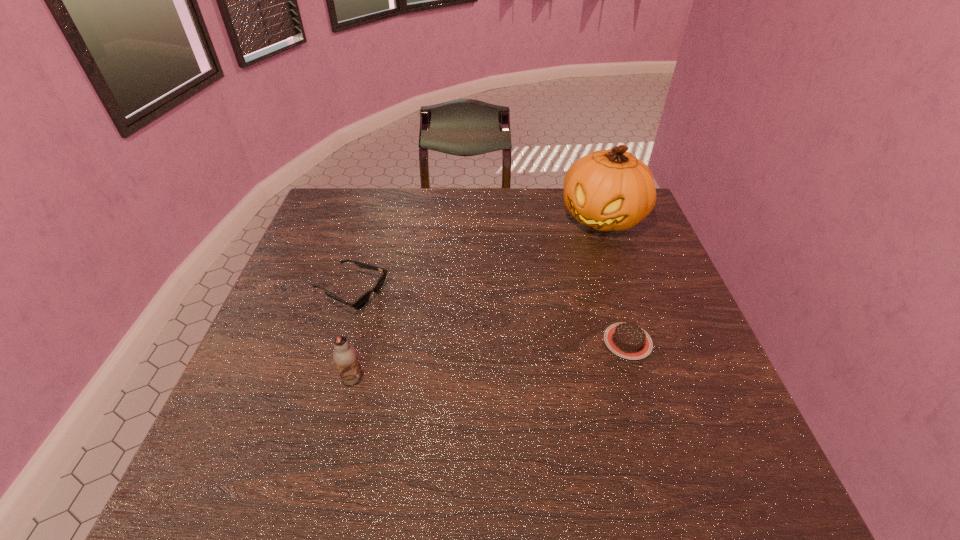
Where is `the nearest object`? This screenshot has height=540, width=960. the nearest object is located at coordinates (345, 357).

Find the location of `the third shortest object`. the third shortest object is located at coordinates (345, 357).

I want to click on the shortest object, so click(x=627, y=340).

Find the location of a particular element. The image size is (960, 540). the third farthest object is located at coordinates (627, 340).

What are the coordinates of `the second farthest object` in the screenshot? It's located at (360, 302).

The width and height of the screenshot is (960, 540). Find the location of `the third tallest object`. the third tallest object is located at coordinates (360, 302).

What are the coordinates of `the farthest object` in the screenshot? It's located at (611, 189).

At what (x,y) coordinates should I click in order to perform the action: click on the tallest object. Please return your answer as a coordinate pair (x, y). Image resolution: width=960 pixels, height=540 pixels. Looking at the image, I should click on (611, 189).

Locate an element on the screen. This screenshot has height=540, width=960. free point located on the back of the third shortest object is located at coordinates (369, 313).

The width and height of the screenshot is (960, 540). What are the coordinates of `blank space located on the left of the second nearest object` in the screenshot? It's located at (532, 341).